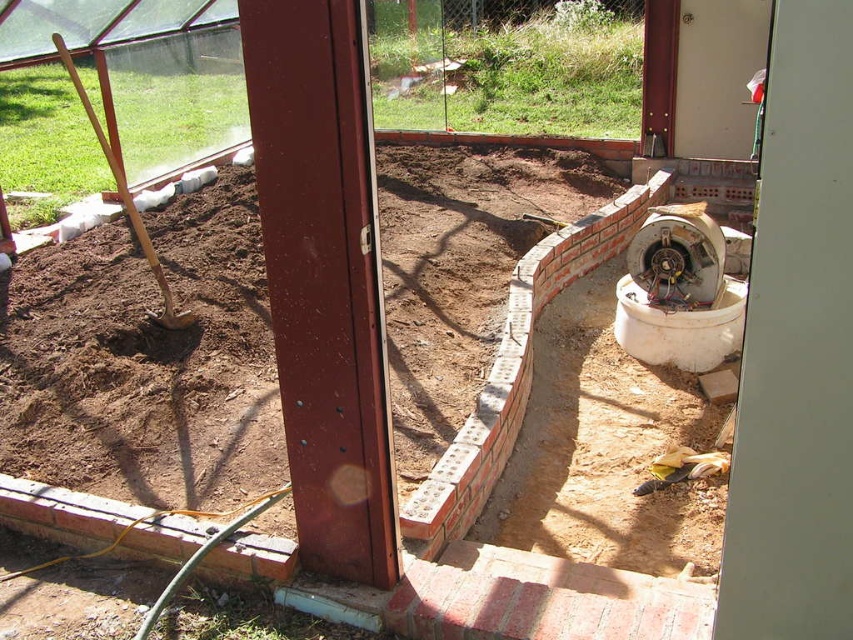
Between point (381, 154) and point (125, 184), which one is positioned behind?

Point (381, 154)

You are a GUI agent. You are given a task and a screenshot of the screen. Output one action in this format:
    pyautogui.click(x=<x>, y=<y>)
    Task: Click on the brown soil at center
    The image size is (853, 640).
    Given the screenshot: What is the action you would take?
    pyautogui.click(x=146, y=362)

Where is `brown soil at center`? The width and height of the screenshot is (853, 640). brown soil at center is located at coordinates (146, 362).

Does brown soil at center lie in front of metallic red pillar at center?

No.

Who is higher up, brown soil at center or metallic red pillar at center?

brown soil at center is above.

Which is in front, point (202, 260) or point (260, 125)?

Point (260, 125)

At what (x,y) coordinates should I click in order to perform the action: click on brown soil at center. Please return your answer as a coordinate pair (x, y). Looking at the image, I should click on (146, 362).

Between metallic red pillar at center and wooden shovel at left, which one is positioned higher?

wooden shovel at left is above.

Is point (276, 195) less distant than point (123, 180)?

Yes, it is in front of point (123, 180).

At what (x,y) coordinates should I click in order to perform the action: click on metallic red pillar at center. Please return your answer as a coordinate pair (x, y). This screenshot has width=853, height=640. Looking at the image, I should click on (323, 278).